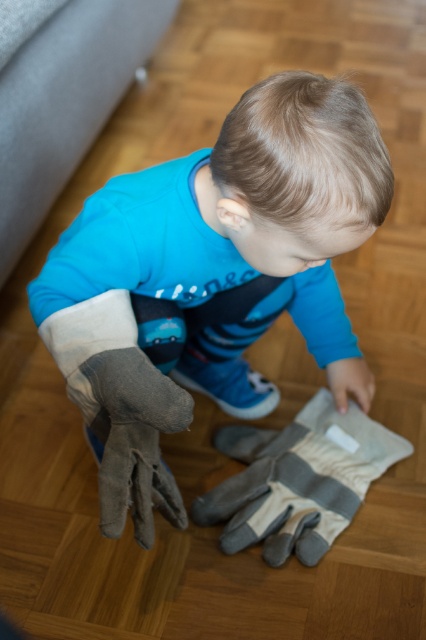
Between matte gray gloves at center and gray fabric glove at lower left, which one is positioned higher?

matte gray gloves at center is higher up.

At what (x,y) coordinates should I click in order to perform the action: click on matte gray gloves at center. Please return your answer as a coordinate pair (x, y). Looking at the image, I should click on (212, 278).

Where is `matte gray gloves at center`? The height and width of the screenshot is (640, 426). matte gray gloves at center is located at coordinates (212, 278).

Between gray fabric glove at center and gray fabric glove at lower left, which one appears on the right side from the viewer's perspective?

gray fabric glove at center

The width and height of the screenshot is (426, 640). What are the coordinates of `gray fabric glove at center` in the screenshot? It's located at (298, 480).

Does matte gray gloves at center have a larger size compared to gray fabric glove at center?

Correct, matte gray gloves at center is larger in size than gray fabric glove at center.

Does point (238, 232) come closer to viewer compared to point (250, 464)?

That is True.

This screenshot has height=640, width=426. What are the coordinates of `matte gray gloves at center` in the screenshot? It's located at (212, 278).